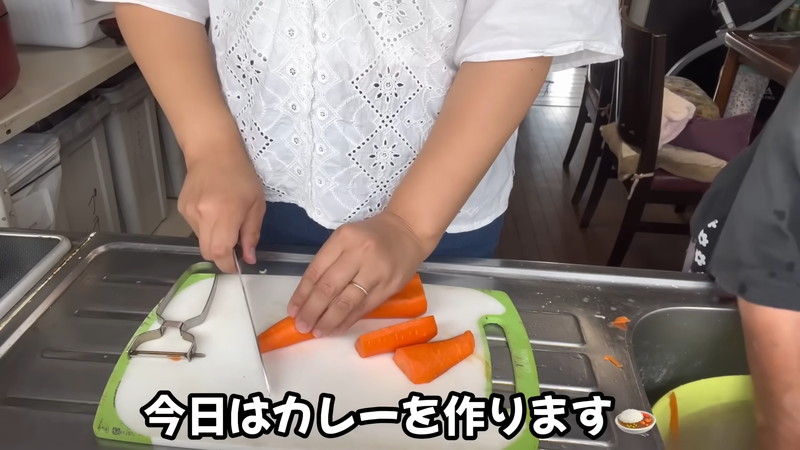
Locate an element on the screen. Image resolution: width=800 pixels, height=450 pixels. knife handle is located at coordinates (236, 254).